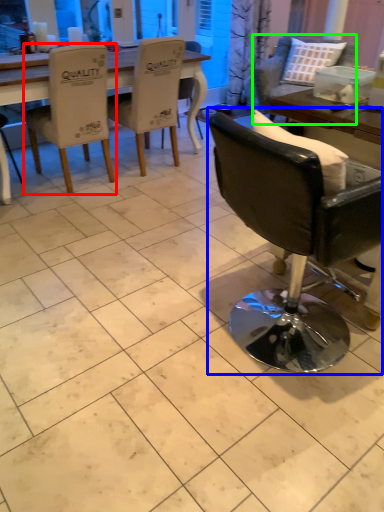
Question: Based on their relative distances, which object is nearer to chair (highlighted by a red box)? Choose from chair (highlighted by a blue box) and chair (highlighted by a green box).

Choices:
 (A) chair
 (B) chair

Answer: (B)